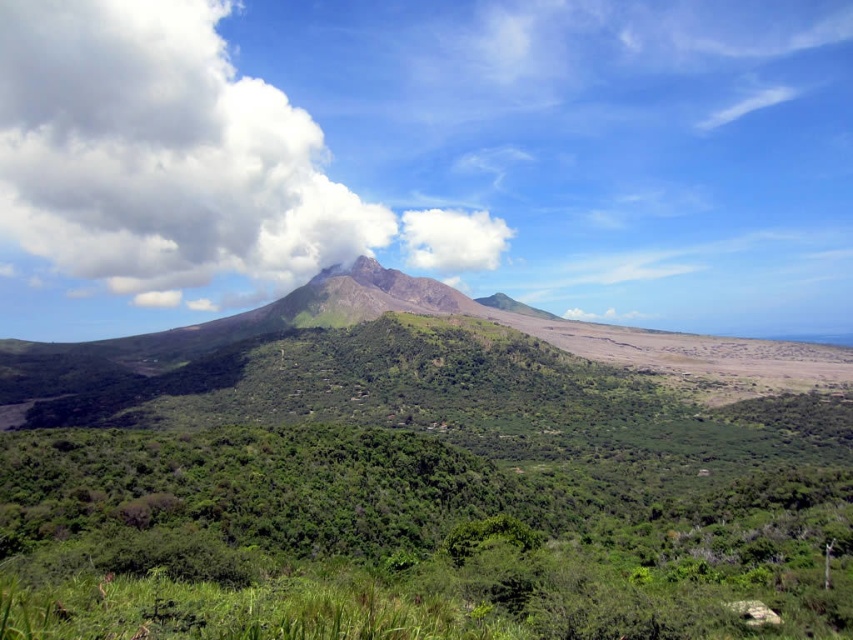
You are a hiker planning to cross the area between the green leafy vegetation at center and the white fluffy cloud at upper left. Considering the width of the vegetation and the cloud, which one do you think you can see more of from your current position?

The white fluffy cloud at upper left has a greater width than the green leafy vegetation at center, so you can see more of the white fluffy cloud at upper left from your current position.

You are a hiker standing at the point marked by point (450, 480), which is in the center of the image. You want to reach the volcanic mountain in the background. Which direction should you head to move towards the volcanic mountain?

The point (450, 480) marks green leafy vegetation at center. To reach the volcanic mountain in the background, you should head towards the background direction from the center, which is towards the back of the image.

You are a hiker planning to take a photo of the green leafy vegetation at center and the white fluffy cloud at upper left. Which object will appear smaller in your photo?

The green leafy vegetation at center will appear smaller in the photo because it is smaller than the white fluffy cloud at upper left.